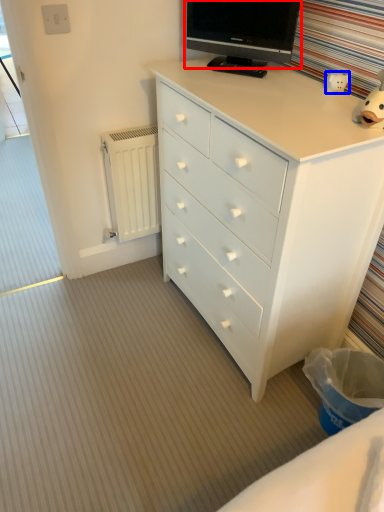
Question: Which object appears farthest to the camera in this image, television (highlighted by a red box) or toy (highlighted by a blue box)?

Choices:
 (A) television
 (B) toy

Answer: (A)